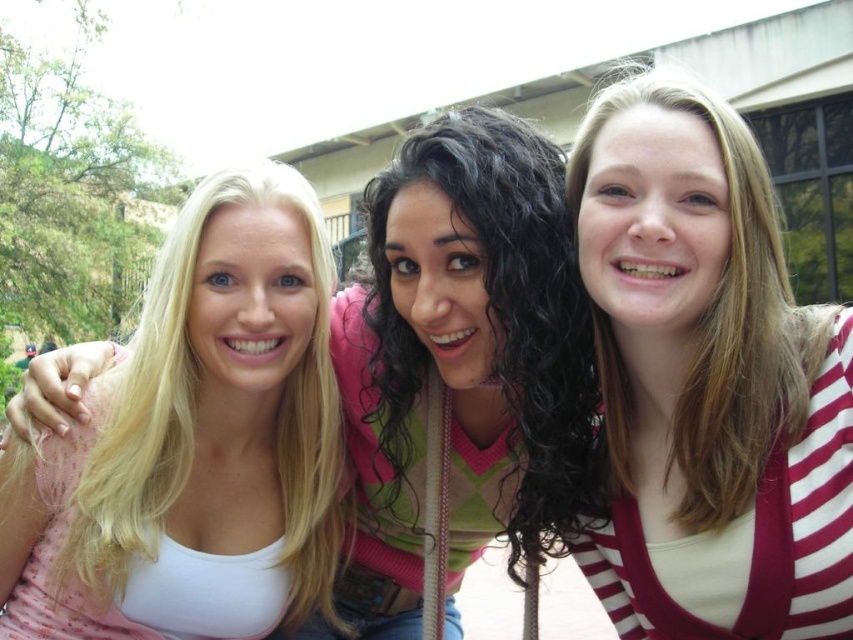
What do you see at coordinates (706, 381) in the screenshot? This screenshot has height=640, width=853. I see `white striped cardigan at center` at bounding box center [706, 381].

Is white striped cardigan at center closer to the viewer compared to blonde hair at left?

Yes.

Between point (727, 344) and point (294, 176), which one is positioned in front?

Point (727, 344)

The height and width of the screenshot is (640, 853). I want to click on white striped cardigan at center, so click(x=706, y=381).